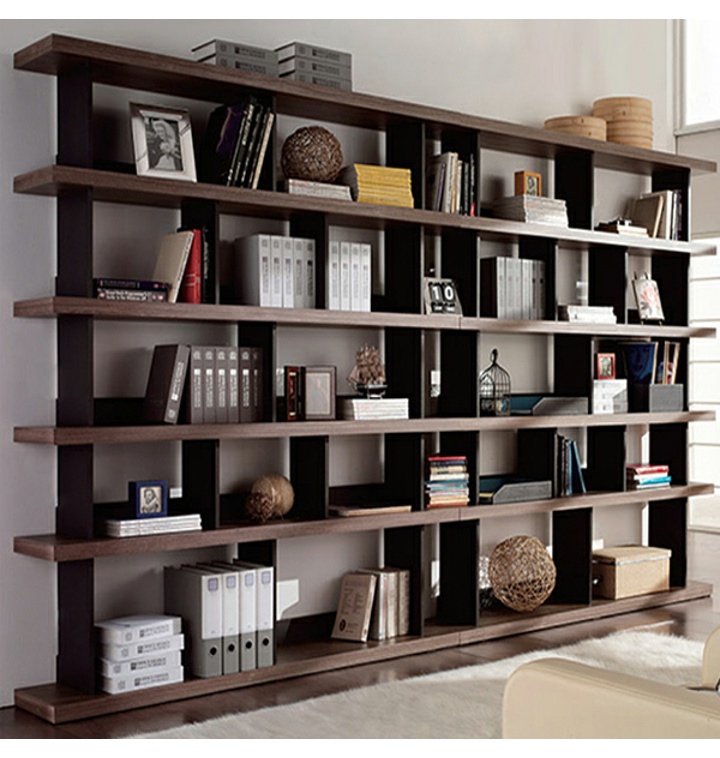
Where is `books on top shelf`? Image resolution: width=720 pixels, height=758 pixels. books on top shelf is located at coordinates (256, 70), (256, 55), (318, 80), (328, 70), (333, 58).